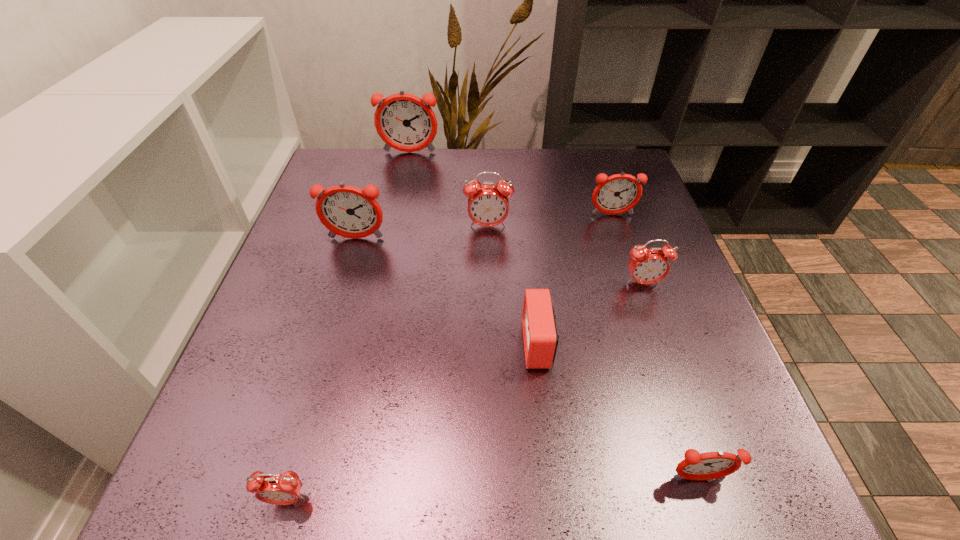
Where is `vacant space located 0.290m on the face of the rightmost red alarm clock`? vacant space located 0.290m on the face of the rightmost red alarm clock is located at coordinates (692, 425).

This screenshot has width=960, height=540. What are the coordinates of `free space located on the front-facing side of the second nearest red alarm clock` in the screenshot? It's located at (315, 344).

This screenshot has height=540, width=960. Identify the location of vacant space located on the front-facing side of the second nearest red alarm clock. (309, 344).

This screenshot has height=540, width=960. Identify the location of vacant space located 0.200m on the front-facing side of the second nearest red alarm clock. (414, 344).

This screenshot has height=540, width=960. I want to click on object at the far edge, so click(405, 122).

The image size is (960, 540). In order to click on object that is at the far left corner in this screenshot , I will do `click(405, 122)`.

Find the location of a particular element. The width and height of the screenshot is (960, 540). object that is at the near left corner is located at coordinates (280, 489).

Identify the location of object located at the near right corner. The width and height of the screenshot is (960, 540). (711, 465).

The height and width of the screenshot is (540, 960). I want to click on free region at the far edge of the desktop, so pos(464,169).

Image resolution: width=960 pixels, height=540 pixels. I want to click on vacant space at the near edge of the desktop, so click(521, 472).